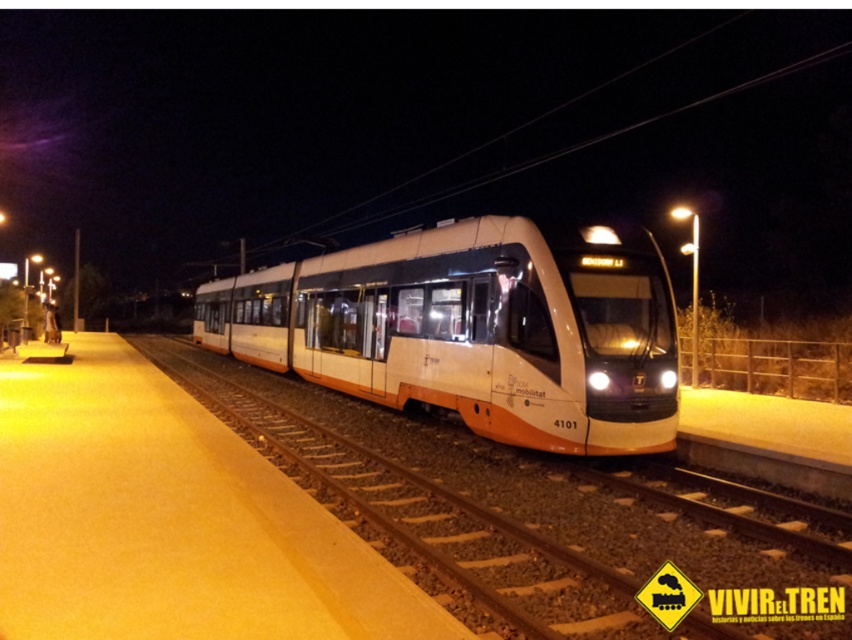
You are a passenger waiting on the platform and see the white metallic track at center and the white glossy train at center. Which object is closer to you as you stand at the edge of the platform?

The white metallic track at center is closer to you because it is positioned in front of the white glossy train at center, meaning it is nearer to your current position on the platform edge.

You are a maintenance worker who needs to inspect the white metallic track at center. You are currently standing on the platform near the white glossy train at center. Can you safely walk to the track without needing to cross the train?

The distance between the white metallic track at center and the white glossy train at center is 16.55 feet, so yes, you can safely walk to the track without needing to cross the train since there is enough space around the train to reach the track.